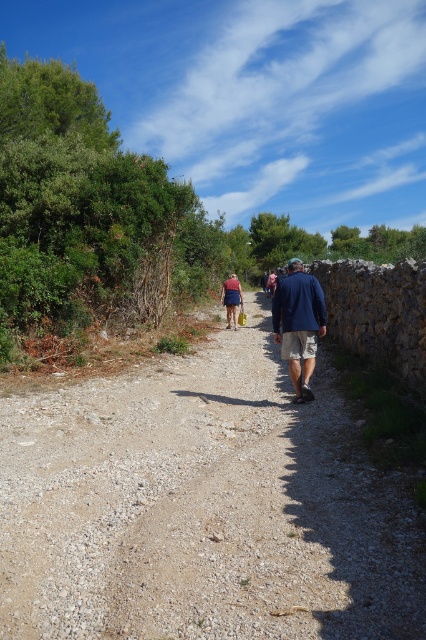
Which is in front, point (317, 480) or point (294, 358)?

Point (317, 480) is more forward.

Is dusty gravel path at center positioned before navy blue jacket at center?

Yes, it is.

Which is behind, point (157, 602) or point (278, 298)?

Point (278, 298)

Where is `dusty gravel path at center`? This screenshot has width=426, height=640. dusty gravel path at center is located at coordinates (201, 508).